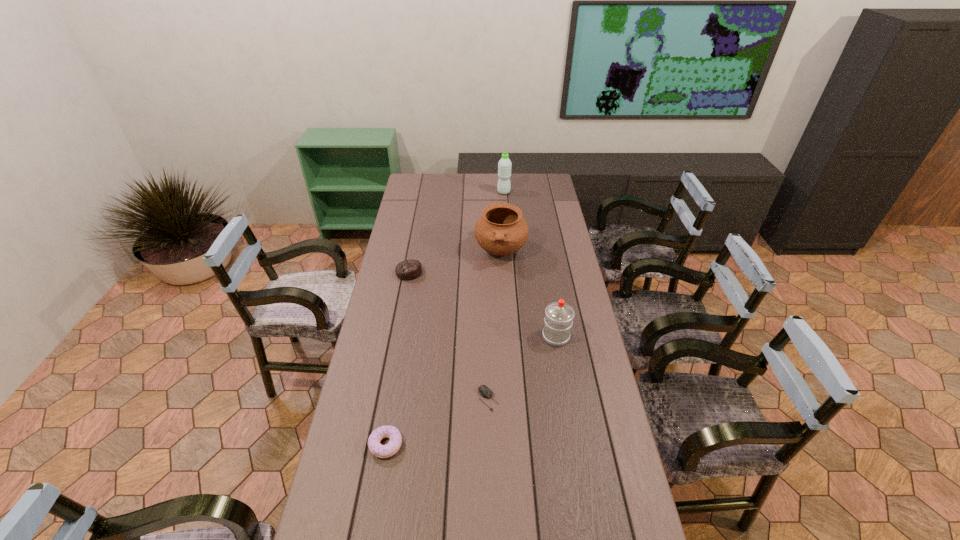
The width and height of the screenshot is (960, 540). I want to click on vacant space that's between the beanbag and the rightmost object, so click(x=483, y=304).

Where is `vacant region between the rightmost object and the third shortest object`? Image resolution: width=960 pixels, height=540 pixels. vacant region between the rightmost object and the third shortest object is located at coordinates (483, 304).

You are a GUI agent. You are given a task and a screenshot of the screen. Output one action in this format:
    pyautogui.click(x=<x>, y=<y>)
    Task: Click on the empty space that is in between the pottery and the doughnut
    
    Given the screenshot: What is the action you would take?
    pyautogui.click(x=444, y=348)

The width and height of the screenshot is (960, 540). Identify the location of empty location between the fourth tallest object and the doughnut. (397, 359).

Locate an element on the screen. This screenshot has width=960, height=540. vacant region between the farthest object and the shorter water bottle is located at coordinates (530, 264).

The width and height of the screenshot is (960, 540). I want to click on object that is the closest to the right water bottle, so click(x=485, y=392).

Choose which object is the fourth nearest neighbor to the third shortest object. Please provide its 2D coordinates. Your answer should be formatted as a tuple, i.e. [(x, y)], where the tuple contains the x and y coordinates of a point satisfying the conditions above.

[(504, 165)]